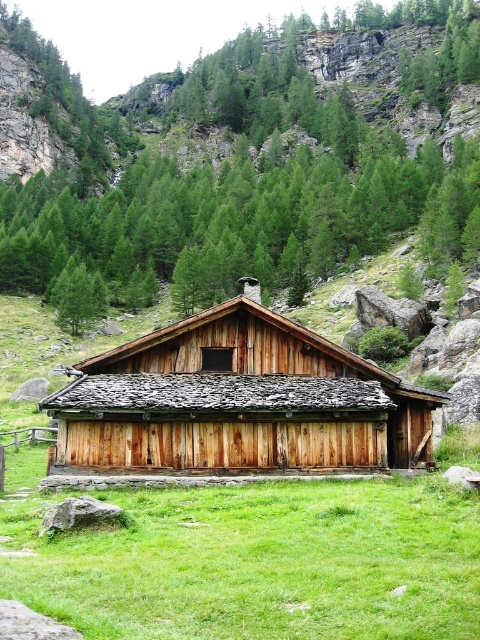
You are standing in front of the rustic wooden cabin and notice the wooden barn at center and the green matte tree at center. Which object is nearer to you?

The wooden barn at center is closer to the viewer than the green matte tree at center.

You are standing in front of the cabin and want to walk towards the wooden barn at center. Which direction should you walk relative to the green grass at center?

Since the green grass at center is located below the wooden barn at center, you should walk upwards towards the wooden barn at center.